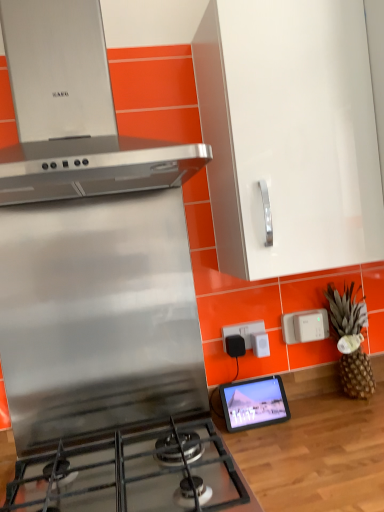
Question: Is point (66, 394) closer or farther from the camera than point (269, 179)?

Choices:
 (A) farther
 (B) closer

Answer: (A)

Question: Choose the correct answer: Is stainless steel stove at center inside white glossy cabinet at upper center or outside it?

Choices:
 (A) inside
 (B) outside

Answer: (B)

Question: Which object is positioned farthest from the white plastic power strip at center?

Choices:
 (A) satin silver range hood at upper left
 (B) stainless steel gas stove at lower left
 (C) white plastic electric outlet at right, which is the 1th electric outlet in right-to-left order
 (D) stainless steel stove at center
 (E) brown textured pineapple at right

Answer: (A)

Question: Considering the real-world distances, which object is farthest from the stainless steel gas stove at lower left?

Choices:
 (A) brown textured pineapple at right
 (B) matte black tablet at center
 (C) white plastic electric outlet at right, which is the 1th electric outlet in right-to-left order
 (D) white glossy cabinet at upper center
 (E) white plastic power strip at center

Answer: (D)